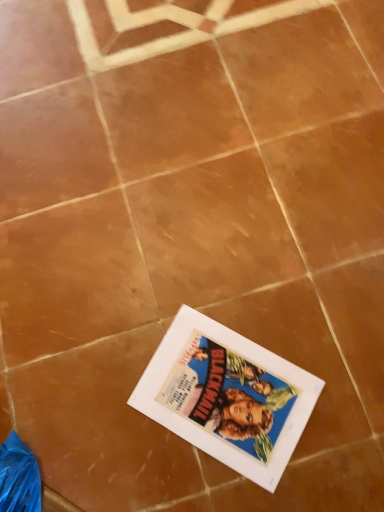
The height and width of the screenshot is (512, 384). What are the coordinates of `free space below matte paper book cover at center (from a real-world perspective)` in the screenshot? It's located at (222, 397).